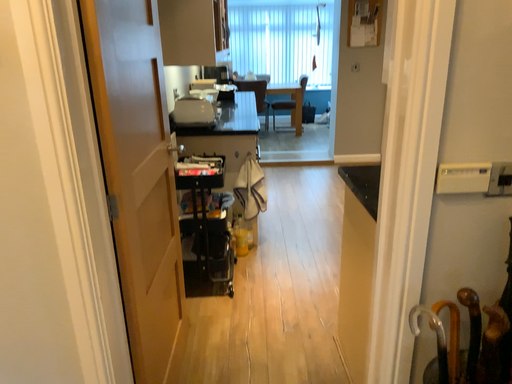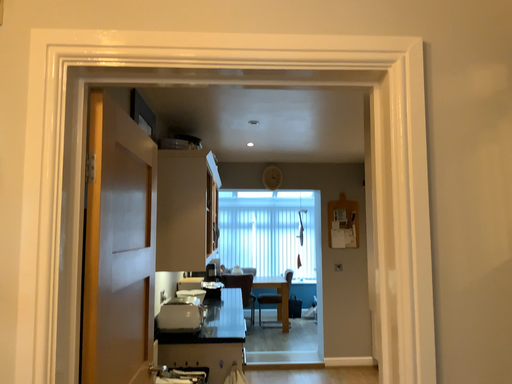
Question: How did the camera likely rotate when shooting the video?

Choices:
 (A) rotated upward
 (B) rotated downward

Answer: (A)